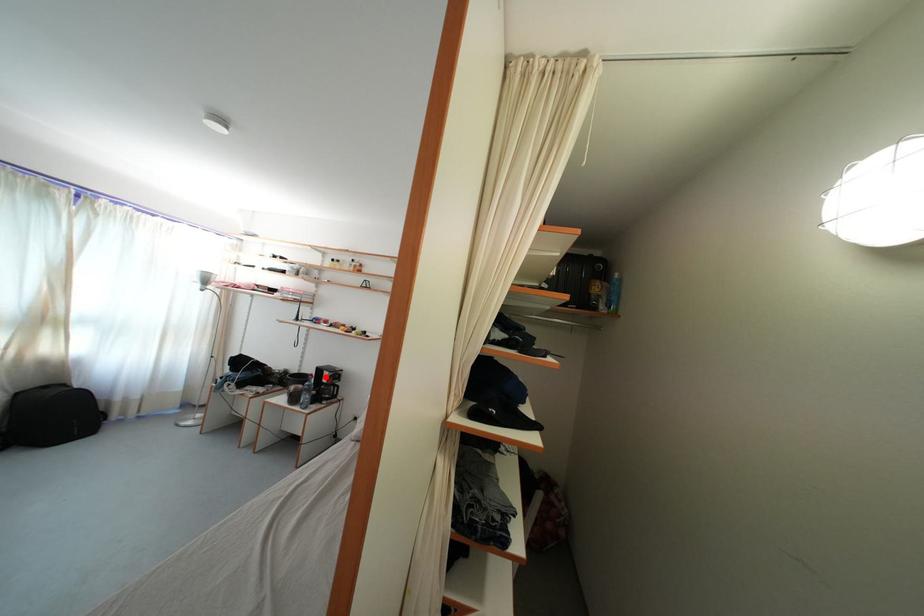
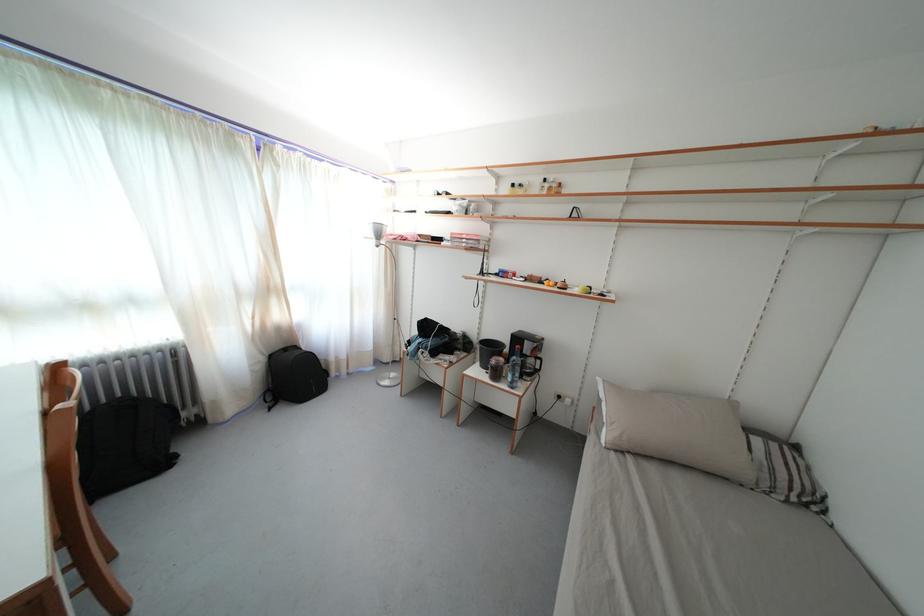
Question: I am providing you with two images of the same scene from different viewpoints. Given a red point in image1, look at the same physical point in image2. Is it:

Choices:
 (A) Closer to the viewpoint
 (B) Farther from the viewpoint

Answer: (A)